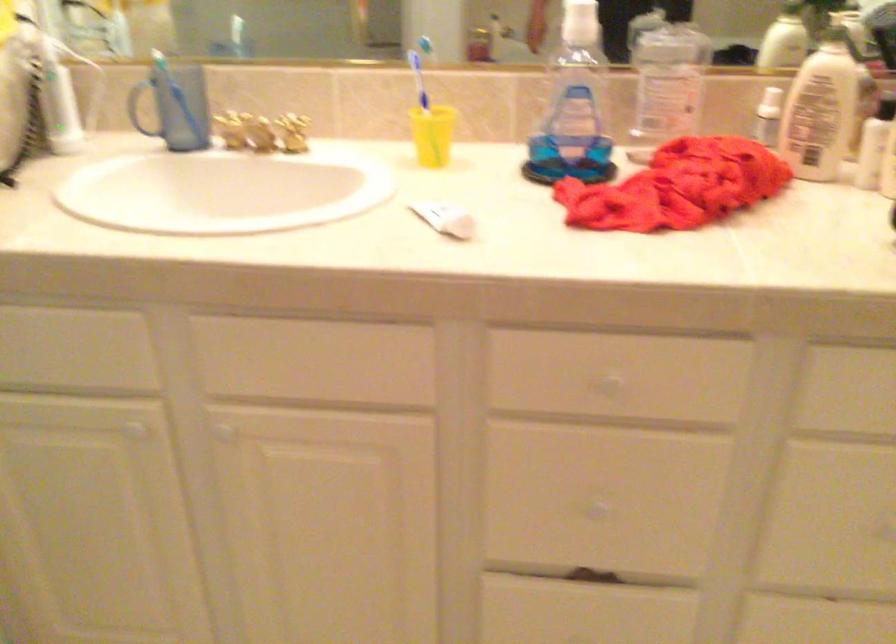
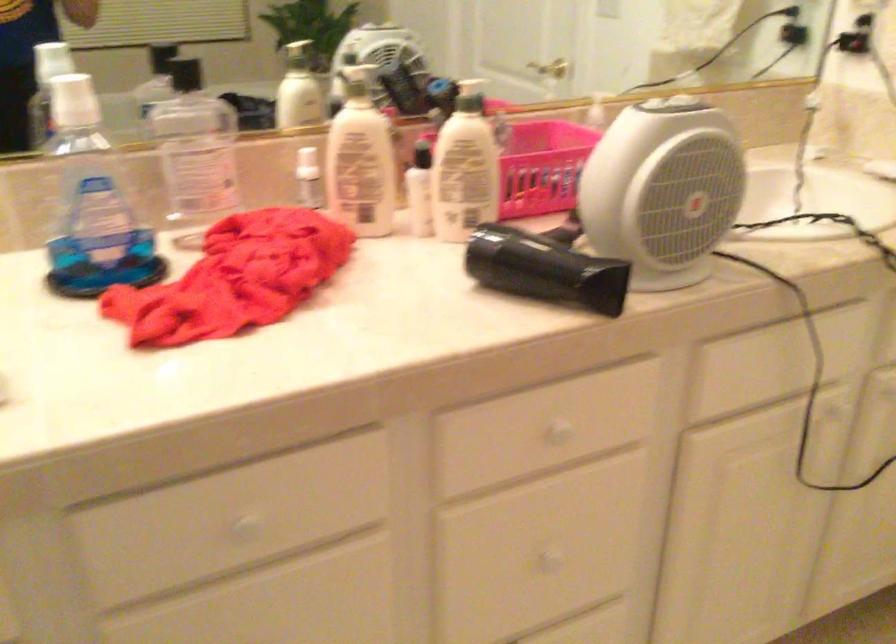
Question: The camera is either moving clockwise (left) or counter-clockwise (right) around the object. The first image is from the beginning of the video and the second image is from the end. Is the camera moving left or right when shooting the video?

Choices:
 (A) Left
 (B) Right

Answer: (A)